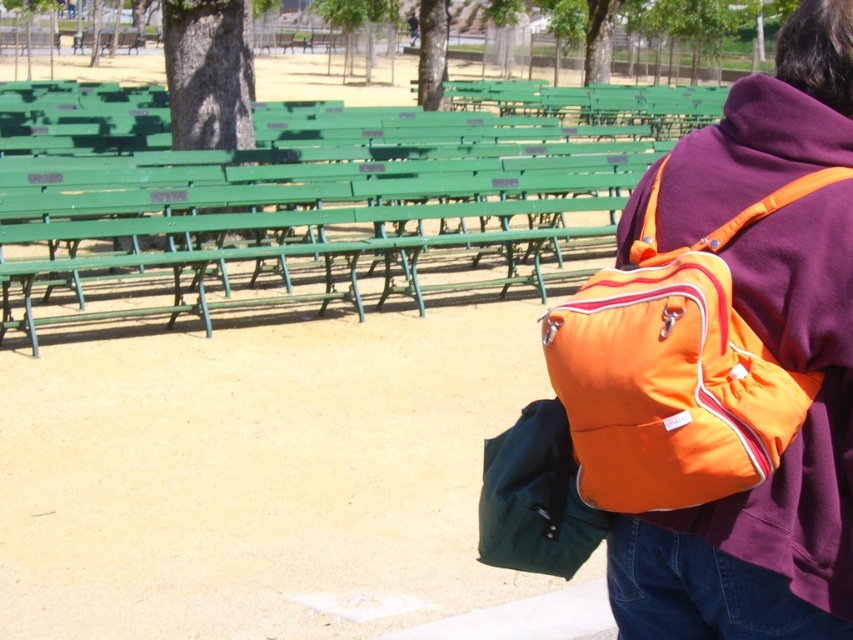
Question: Which point is closer to the camera?

Choices:
 (A) (590, 540)
 (B) (795, 60)

Answer: (B)

Question: Is green painted wood bench at center below matte green duffel bag at lower right?

Choices:
 (A) yes
 (B) no

Answer: (B)

Question: Considering the real-world distances, which object is closest to the matte green duffel bag at lower right?

Choices:
 (A) orange nylon backpack at right
 (B) green painted wood bench at center

Answer: (A)

Question: Does orange nylon backpack at right have a lesser width compared to matte green duffel bag at lower right?

Choices:
 (A) yes
 (B) no

Answer: (B)

Question: Does green painted wood bench at center have a larger size compared to orange nylon backpack at right?

Choices:
 (A) no
 (B) yes

Answer: (B)

Question: Which object appears farthest from the camera in this image?

Choices:
 (A) matte green duffel bag at lower right
 (B) green painted wood bench at center

Answer: (B)